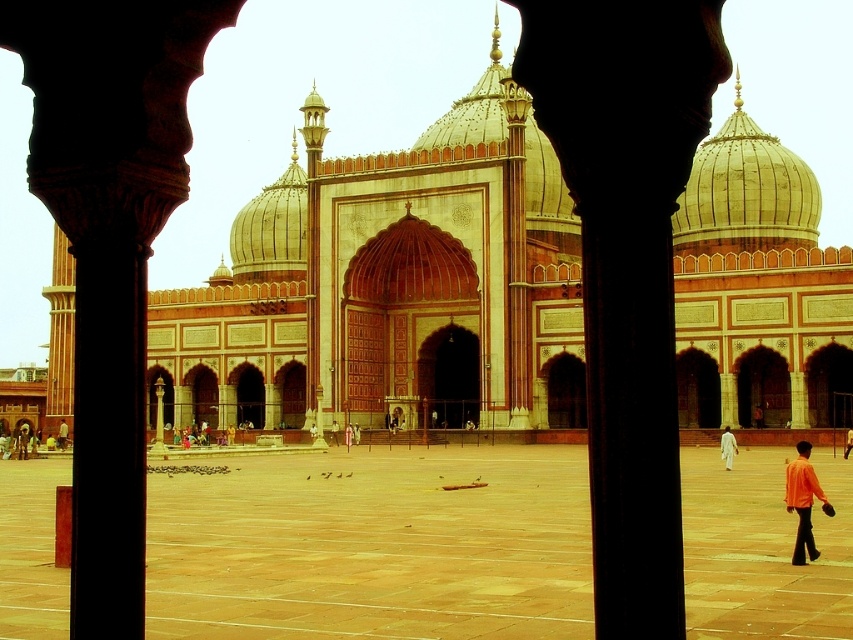
Which of these two, black stone pillar at center or white cotton person at center, stands shorter?

With less height is white cotton person at center.

The height and width of the screenshot is (640, 853). Describe the element at coordinates (627, 264) in the screenshot. I see `black stone pillar at center` at that location.

You are a GUI agent. You are given a task and a screenshot of the screen. Output one action in this format:
    pyautogui.click(x=<x>, y=<y>)
    Task: Click on the black stone pillar at center
    The height and width of the screenshot is (640, 853).
    Given the screenshot: What is the action you would take?
    pyautogui.click(x=627, y=264)

Can you confirm if smooth stone palace at center is bigger than white cotton person at center?

Indeed, smooth stone palace at center has a larger size compared to white cotton person at center.

Find the location of `smooth stone palace at center`. smooth stone palace at center is located at coordinates (758, 285).

Is point (753, 220) less distant than point (721, 444)?

No, (753, 220) is further to viewer.

Identify the location of smooth stone palace at center. This screenshot has height=640, width=853. (758, 285).

Who is positioned more to the right, smooth stone courtyard at center or orange cotton shirt at lower right?

orange cotton shirt at lower right

Based on the photo, is smooth stone courtyard at center to the right of orange cotton shirt at lower right from the viewer's perspective?

No, smooth stone courtyard at center is not to the right of orange cotton shirt at lower right.

Which is behind, point (759, 563) or point (827, 506)?

The point (827, 506) is more distant.

At what (x,y) coordinates should I click in order to perform the action: click on smooth stone courtyard at center. Please return your answer as a coordinate pair (x, y). Looking at the image, I should click on (373, 547).